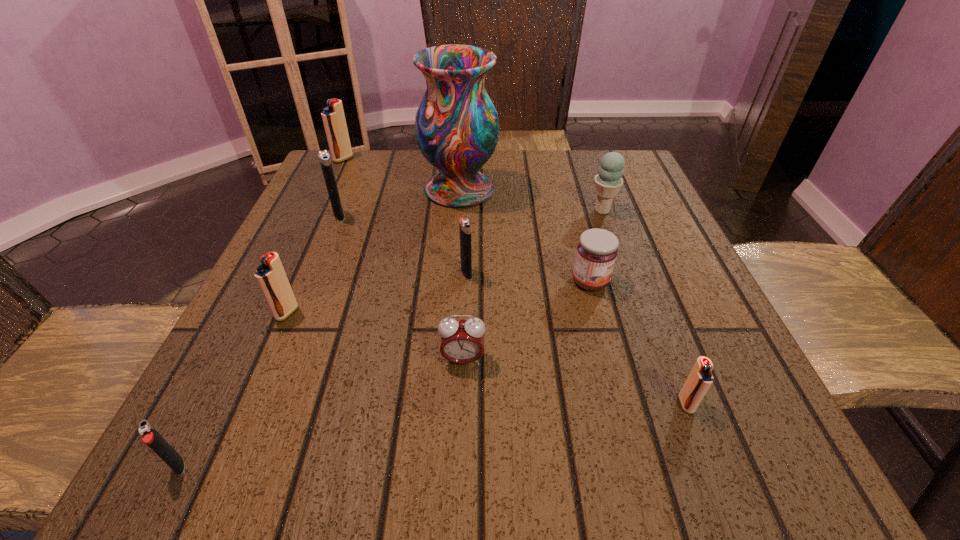
Image resolution: width=960 pixels, height=540 pixels. In order to click on vacant space at the near left corner in this screenshot , I will do click(177, 442).

Where is `vacant area at the near right corner`? The height and width of the screenshot is (540, 960). vacant area at the near right corner is located at coordinates (752, 441).

Identify the location of vacant space that's between the leftmost black igniter and the ice cream. (391, 338).

You are a GUI agent. You are given a task and a screenshot of the screen. Output one action in this format:
    pyautogui.click(x=<x>, y=<y>)
    Task: Click on the vacant area between the second nearest red igniter and the pink alarm clock
    The height and width of the screenshot is (540, 960).
    Given the screenshot: What is the action you would take?
    pyautogui.click(x=374, y=336)

The width and height of the screenshot is (960, 540). Identify the location of vacant region between the rightmost black igniter and the biggest red igniter. (405, 216).

This screenshot has height=540, width=960. I want to click on free spot between the second farthest red igniter and the nearest black igniter, so click(x=232, y=389).

Where is `free space between the farthest red igniter and the second smallest black igniter`? The image size is (960, 540). free space between the farthest red igniter and the second smallest black igniter is located at coordinates (405, 216).

Find the location of `free area in between the nearest igniter and the biggest red igniter`. free area in between the nearest igniter and the biggest red igniter is located at coordinates pyautogui.click(x=261, y=312).

At what (x,y) coordinates should I click in order to perform the action: click on blank region between the second black igniter from left to right and the fifth farthest igniter. Please return your answer as a coordinate pair (x, y). Looking at the image, I should click on (513, 309).

Find the location of `vacant point located between the fourth nearest igniter and the nearest red igniter`. vacant point located between the fourth nearest igniter and the nearest red igniter is located at coordinates (576, 339).